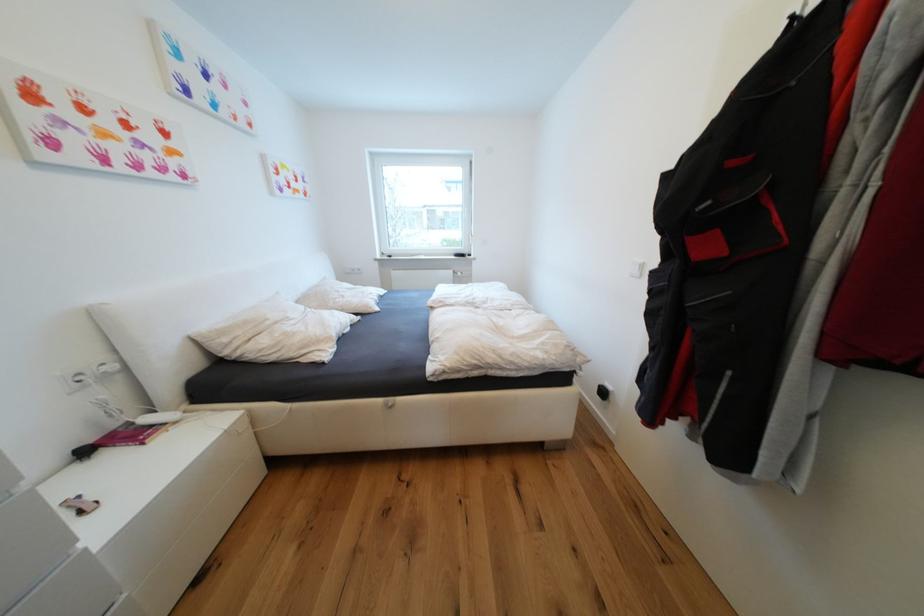
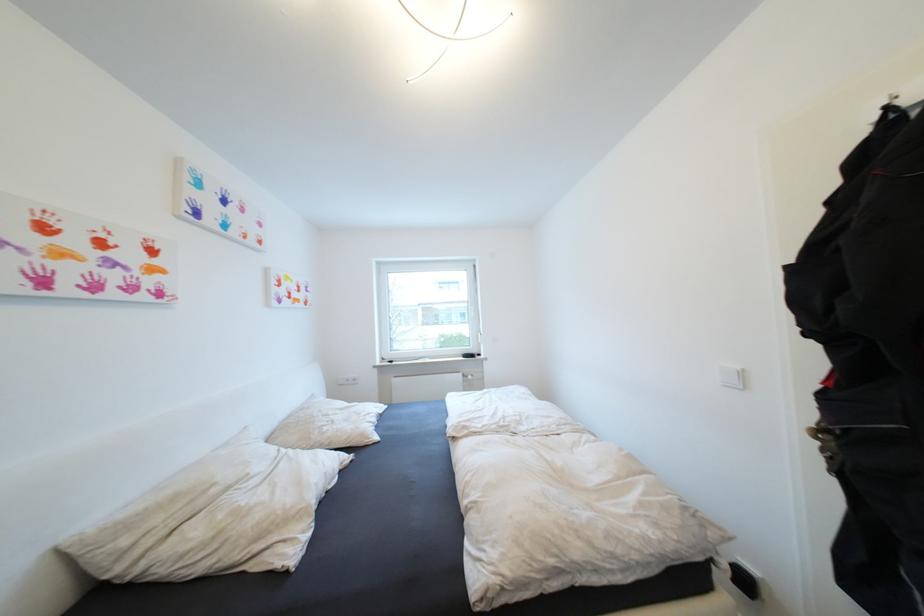
In the second image, find the point that corresponds to the point at 349,297 in the first image.

(339, 423)